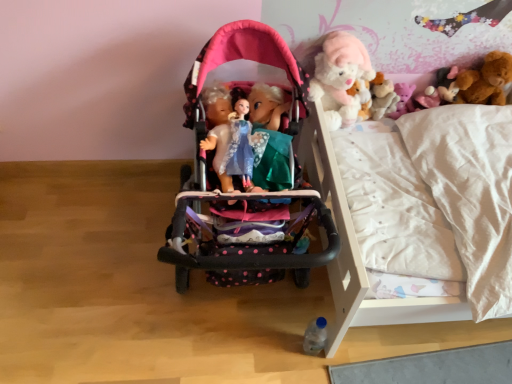
Locate an element on the screen. This screenshot has width=512, height=384. free space on the front side of clear plastic bottle at lower center, the fourth toy when ordered from top to bottom is located at coordinates (313, 373).